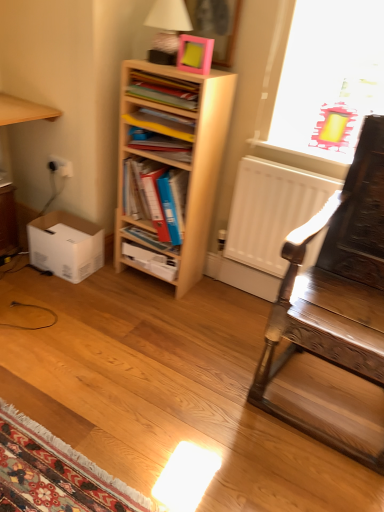
Locate an element on the screen. The height and width of the screenshot is (512, 384). free spot to the right of white cardboard box at lower left is located at coordinates (117, 282).